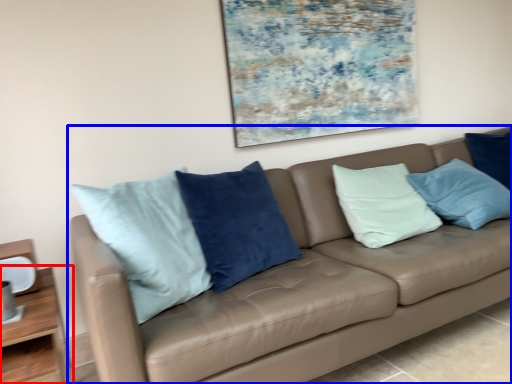
Question: Which object is further to the camera taking this photo, table (highlighted by a red box) or studio couch (highlighted by a blue box)?

Choices:
 (A) table
 (B) studio couch

Answer: (A)